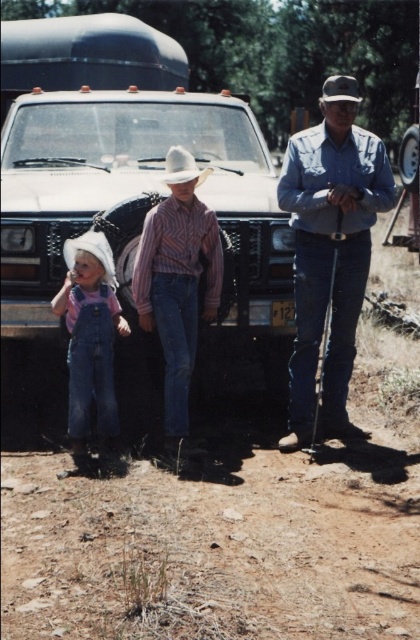
From the picture: Who is lower down, striped cotton shirt at center or white felt cowboy hat at center?

Positioned lower is striped cotton shirt at center.

Who is taller, striped cotton shirt at center or white felt cowboy hat at center?

With more height is striped cotton shirt at center.

Is point (222, 260) positioned in front of point (191, 160)?

No, it is not.

You are a GUI agent. You are given a task and a screenshot of the screen. Output one action in this format:
    pyautogui.click(x=<x>, y=<y>)
    Task: Click on the striped cotton shirt at center
    The image size is (420, 640).
    Given the screenshot: What is the action you would take?
    click(178, 280)

Is point (147, 632) more distant than point (333, 93)?

No.

Does brown dirt track at lower center have a larger size compared to white felt cowboy hat at upper center?

No.

Is point (251, 570) farther from camera compared to point (356, 99)?

No, (251, 570) is closer to viewer.

Identify the location of brown dirt track at lower center. (212, 552).

Which is above, striped cotton shirt at center or white felt cowboy hat at upper center?

Positioned higher is white felt cowboy hat at upper center.

Between striped cotton shirt at center and white felt cowboy hat at upper center, which one appears on the right side from the viewer's perspective?

white felt cowboy hat at upper center

Is point (139, 321) positioned behind point (331, 97)?

Yes, point (139, 321) is behind point (331, 97).

Image resolution: width=420 pixels, height=640 pixels. Identify the location of striped cotton shirt at center. (178, 280).